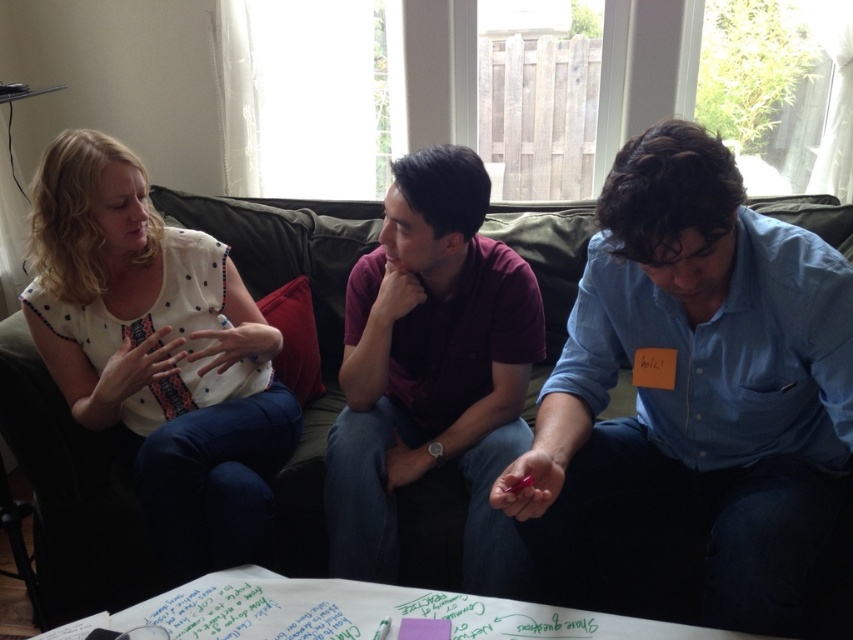
Question: Does green fabric couch at center have a smaller size compared to white dotted blouse at left?

Choices:
 (A) no
 (B) yes

Answer: (A)

Question: Is blue cotton shirt at center positioned behind green fabric couch at center?

Choices:
 (A) yes
 (B) no

Answer: (B)

Question: Can you confirm if white dotted blouse at left is positioned below maroon polo shirt at center?

Choices:
 (A) yes
 (B) no

Answer: (B)

Question: Which of the following is the closest to the observer?

Choices:
 (A) green fabric couch at center
 (B) maroon polo shirt at center
 (C) blue cotton shirt at center

Answer: (C)

Question: Among these objects, which one is nearest to the camera?

Choices:
 (A) white dotted blouse at left
 (B) green fabric couch at center

Answer: (A)

Question: Which object is farther from the camera taking this photo?

Choices:
 (A) green fabric couch at center
 (B) white dotted blouse at left
 (C) maroon polo shirt at center

Answer: (A)